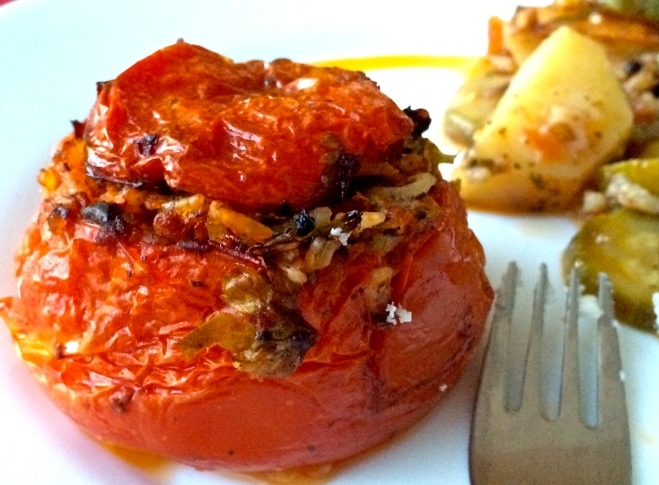
This screenshot has width=659, height=485. What are the coordinates of `end of a silver fork with four points` in the screenshot? It's located at (558, 443).